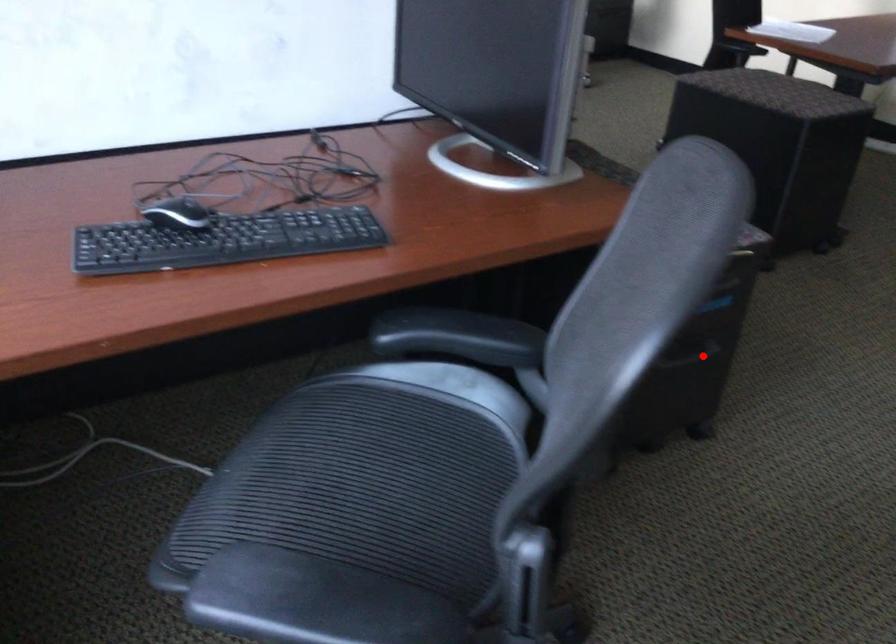
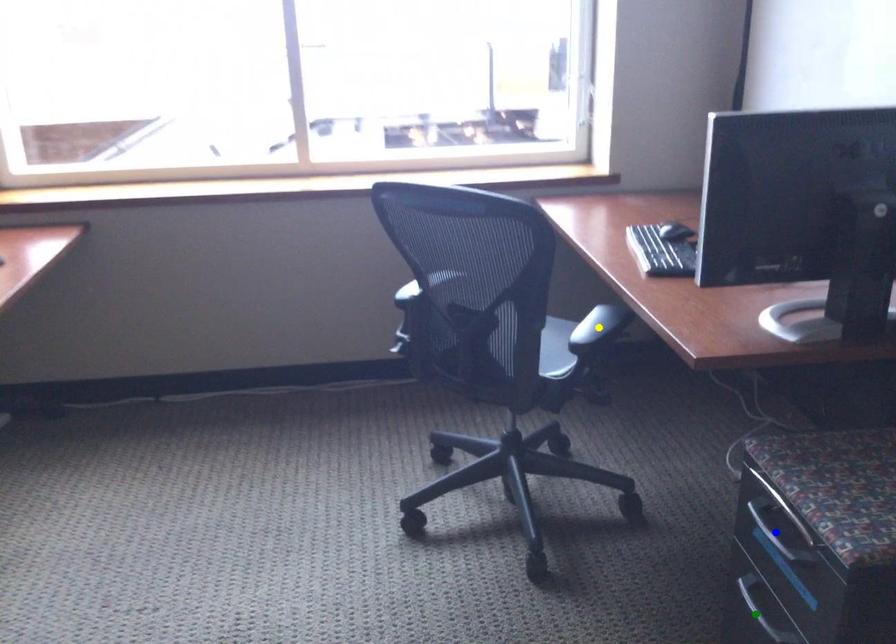
Question: I am providing you with two images of the same scene from different viewpoints. A red point is marked on the first image. You are given multiple points on the second image. Which mark in image 2 goes with the point in image 1?

Choices:
 (A) green point
 (B) blue point
 (C) yellow point

Answer: (A)